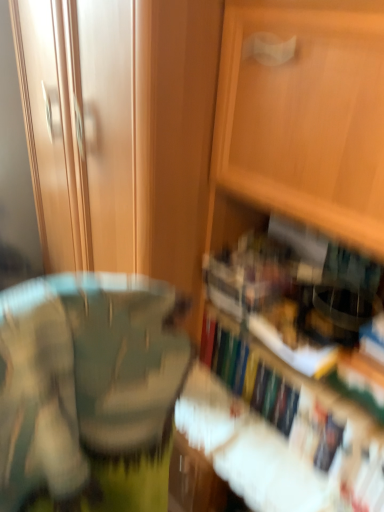
Measure the distance between point (x=224, y=327) and camera.

They are 1.26 meters apart.

This screenshot has height=512, width=384. Describe the element at coordinates (300, 410) in the screenshot. I see `hardcover book at lower right` at that location.

What are the coordinates of `hardcover book at lower right` in the screenshot? It's located at (300, 410).

What do you see at coordinates (301, 120) in the screenshot? I see `wooden cabinet at center` at bounding box center [301, 120].

What is the approximate width of wooden cabinet at center?

The width of wooden cabinet at center is 22.58 inches.

In order to face wooden cabinet at center, should I rotate leftwards or rightwards?

To face it directly, rotate right by 13.798 degrees.

Identify the location of wooden cabinet at center. The width and height of the screenshot is (384, 512). (301, 120).

Locate an element on the screen. Image resolution: width=384 pixels, height=512 pixels. hardcover book at lower right is located at coordinates click(x=300, y=410).

Can you confirm if wooden cabinet at center is positioned to the right of hardcover book at lower right?

No.

Is the position of wooden cabinet at center less distant than that of hardcover book at lower right?

Yes, wooden cabinet at center is closer to the camera.

Is point (314, 165) positioned in front of point (253, 361)?

Yes, it is in front of point (253, 361).

From the image's perspective, which one is positioned lower, wooden cabinet at center or hardcover book at lower right?

hardcover book at lower right.

From a real-world perspective, which object stands above the other?

From a 3D spatial view, wooden cabinet at center is above.

In the scene shown: Between wooden cabinet at center and hardcover book at lower right, which one has smaller width?

Thinner between the two is hardcover book at lower right.

Can you confirm if wooden cabinet at center is taller than hardcover book at lower right?

Yes.

Which of these two, wooden cabinet at center or hardcover book at lower right, is bigger?

wooden cabinet at center is bigger.

Is wooden cabinet at center located outside hardcover book at lower right?

wooden cabinet at center is positioned outside hardcover book at lower right.

Is wooden cabinet at center far from hardcover book at lower right?

No, wooden cabinet at center is not far from hardcover book at lower right.

Is wooden cabinet at center facing away from hardcover book at lower right?

Yes, hardcover book at lower right is at the back of wooden cabinet at center.

Can you tell me how much wooden cabinet at center and hardcover book at lower right differ in facing direction?

There is a 1.32-degree angle between the facing directions of wooden cabinet at center and hardcover book at lower right.

The height and width of the screenshot is (512, 384). Identify the location of book below the wooden cabinet at center (from the image's perspective). (300, 410).

Is hardcover book at lower right to the right of wooden cabinet at center from the viewer's perspective?

Indeed, hardcover book at lower right is positioned on the right side of wooden cabinet at center.

Is hardcover book at lower right in front of or behind wooden cabinet at center in the image?

In the image, hardcover book at lower right appears behind wooden cabinet at center.

Considering the points (298, 426) and (262, 9), which point is behind, point (298, 426) or point (262, 9)?

Point (298, 426)

From the image's perspective, which one is positioned higher, hardcover book at lower right or wooden cabinet at center?

wooden cabinet at center.

From a real-world perspective, is hardcover book at lower right positioned above or below wooden cabinet at center?

From a real-world perspective, hardcover book at lower right is physically below wooden cabinet at center.

Which object is thinner, hardcover book at lower right or wooden cabinet at center?

hardcover book at lower right is thinner.

In terms of height, does hardcover book at lower right look taller or shorter compared to wooden cabinet at center?

Clearly, hardcover book at lower right is shorter compared to wooden cabinet at center.

Looking at the image, does hardcover book at lower right seem bigger or smaller compared to wooden cabinet at center?

hardcover book at lower right is smaller than wooden cabinet at center.

Choose the correct answer: Is hardcover book at lower right inside wooden cabinet at center or outside it?

hardcover book at lower right is contained in wooden cabinet at center.

Is hardcover book at lower right positioned far away from wooden cabinet at center?

No, hardcover book at lower right is not far away from wooden cabinet at center.

Is hardcover book at lower right looking in the opposite direction of wooden cabinet at center?

Yes, hardcover book at lower right's orientation is away from wooden cabinet at center.

Where is `book below the wooden cabinet at center (from the image's perspective)`? Image resolution: width=384 pixels, height=512 pixels. book below the wooden cabinet at center (from the image's perspective) is located at coordinates (300, 410).

Where is `cabinetry on the left of hardcover book at lower right`? cabinetry on the left of hardcover book at lower right is located at coordinates (301, 120).

Locate an element on the screen. book on the right of wooden cabinet at center is located at coordinates (300, 410).